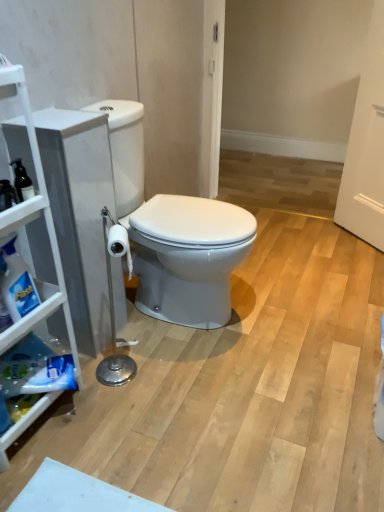
The image size is (384, 512). What are the coordinates of `empty space that is in between white glossy toilet at center and white matte cabinet at left` in the screenshot? It's located at (136, 379).